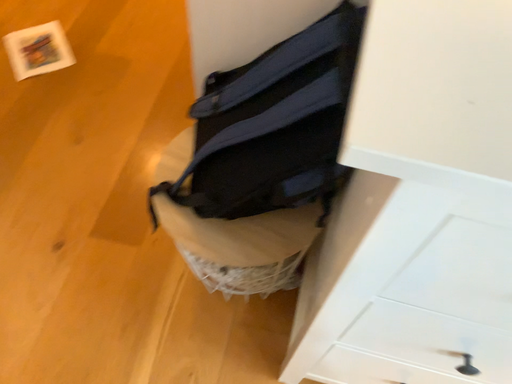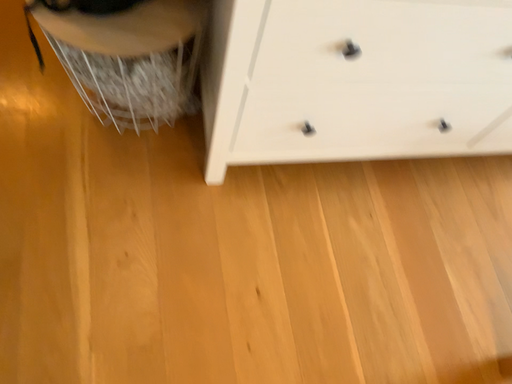
Question: Which way did the camera rotate in the video?

Choices:
 (A) rotated downward
 (B) rotated upward

Answer: (A)